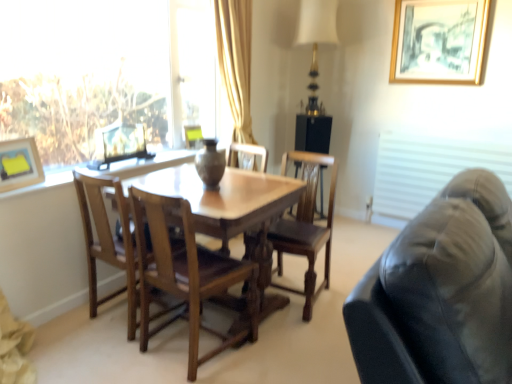
Locate an element on the screen. The width and height of the screenshot is (512, 384). free point to the left of wooden chair at center, which appears as the 2th chair when viewed from the right is located at coordinates (104, 356).